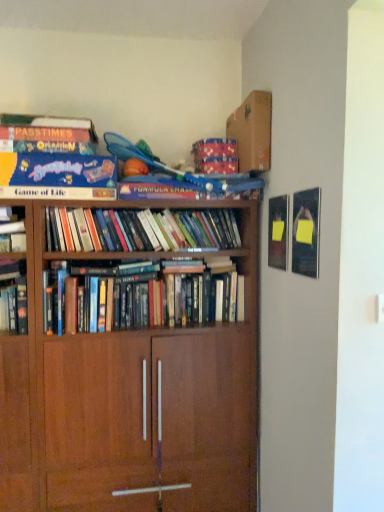
Question: Is hardcover books at center, placed as the 2th book when sorted from top to bottom, wider than blue cardboard game of life at upper left, arranged as the third book when ordered from the bottom?

Choices:
 (A) yes
 (B) no

Answer: (B)

Question: Is hardcover books at center, acting as the 2th book starting from the bottom, closer to the viewer compared to blue cardboard game of life at upper left, placed as the first book when sorted from top to bottom?

Choices:
 (A) yes
 (B) no

Answer: (B)

Question: Is hardcover books at center, placed as the 2th book when sorted from top to bottom, positioned with its back to blue cardboard game of life at upper left, placed as the first book when sorted from top to bottom?

Choices:
 (A) no
 (B) yes

Answer: (A)

Question: From the image's perspective, is hardcover books at center, placed as the 2th book when sorted from top to bottom, below blue cardboard game of life at upper left, arranged as the third book when ordered from the bottom?

Choices:
 (A) no
 (B) yes

Answer: (B)

Question: Is blue cardboard game of life at upper left, arranged as the third book when ordered from the bottom, inside hardcover books at center, placed as the 2th book when sorted from top to bottom?

Choices:
 (A) yes
 (B) no

Answer: (B)

Question: From a real-world perspective, is hardcover books at center, placed as the 2th book when sorted from top to bottom, physically located above or below hardcover books at center, placed as the 1th book when sorted from bottom to top?

Choices:
 (A) below
 (B) above

Answer: (B)

Question: Would you say hardcover books at center, placed as the 2th book when sorted from top to bottom, is inside or outside hardcover books at center, the 3th book in the top-to-bottom sequence?

Choices:
 (A) inside
 (B) outside

Answer: (B)

Question: From their relative heights in the image, would you say hardcover books at center, acting as the 2th book starting from the bottom, is taller or shorter than hardcover books at center, placed as the 1th book when sorted from bottom to top?

Choices:
 (A) short
 (B) tall

Answer: (A)

Question: Is hardcover books at center, acting as the 2th book starting from the bottom, in front of or behind hardcover books at center, placed as the 1th book when sorted from bottom to top, in the image?

Choices:
 (A) front
 (B) behind

Answer: (B)

Question: From a real-world perspective, is blue cardboard game of life at upper left, arranged as the third book when ordered from the bottom, above or below cardboard at upper center?

Choices:
 (A) above
 (B) below

Answer: (B)

Question: Is point (91, 142) closer or farther from the camera than point (249, 132)?

Choices:
 (A) farther
 (B) closer

Answer: (B)

Question: Is blue cardboard game of life at upper left, arranged as the third book when ordered from the bottom, bigger or smaller than cardboard at upper center?

Choices:
 (A) big
 (B) small

Answer: (A)

Question: From the image's perspective, relative to cardboard at upper center, is blue cardboard game of life at upper left, arranged as the third book when ordered from the bottom, above or below?

Choices:
 (A) above
 (B) below

Answer: (B)

Question: In terms of width, does brown wood bookcase at center look wider or thinner when compared to hardcover books at center, the 3th book in the top-to-bottom sequence?

Choices:
 (A) wide
 (B) thin

Answer: (A)

Question: Based on their positions, is brown wood bookcase at center located to the left or right of hardcover books at center, the 3th book in the top-to-bottom sequence?

Choices:
 (A) left
 (B) right

Answer: (A)